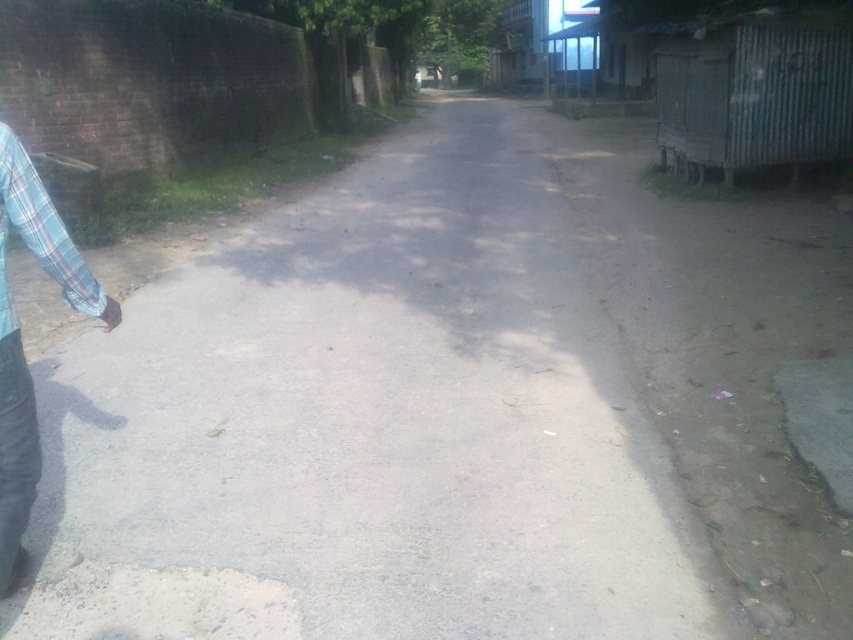
Which of these two, gray concrete pavement at center or blue plaid shirt at left, stands shorter?

gray concrete pavement at center is shorter.

Does point (450, 609) come farther from viewer compared to point (16, 529)?

Yes, point (450, 609) is behind point (16, 529).

Locate an element on the screen. gray concrete pavement at center is located at coordinates (368, 426).

Where is `gray concrete pavement at center`? The width and height of the screenshot is (853, 640). gray concrete pavement at center is located at coordinates (368, 426).

The width and height of the screenshot is (853, 640). What do you see at coordinates (368, 426) in the screenshot?
I see `gray concrete pavement at center` at bounding box center [368, 426].

Where is `gray concrete pavement at center`? The height and width of the screenshot is (640, 853). gray concrete pavement at center is located at coordinates (368, 426).

What do you see at coordinates (20, 339) in the screenshot? I see `blue plaid shirt at left` at bounding box center [20, 339].

Can you confirm if blue plaid shirt at left is positioned to the left of plaid fabric shirt at left?

Incorrect, blue plaid shirt at left is not on the left side of plaid fabric shirt at left.

Is point (83, 304) positioned before point (3, 307)?

No.

The height and width of the screenshot is (640, 853). What are the coordinates of `blue plaid shirt at left` in the screenshot? It's located at (20, 339).